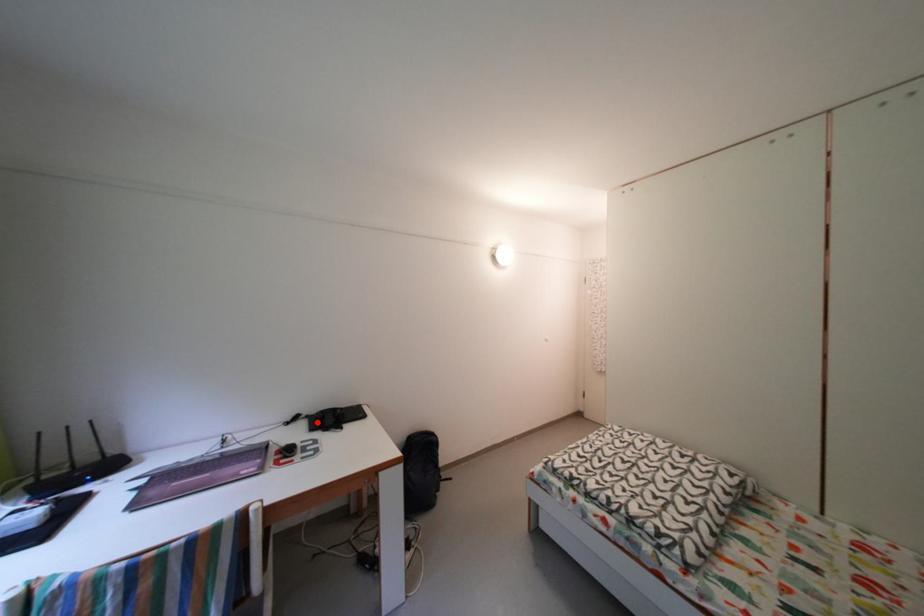
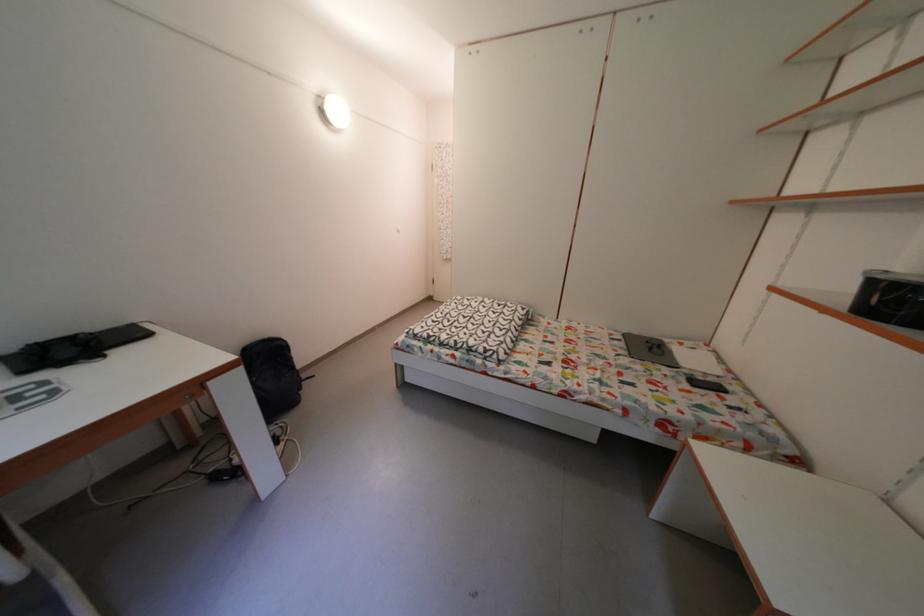
In the second image, find the point that corresponds to the highlighted location in the first image.

(6, 363)